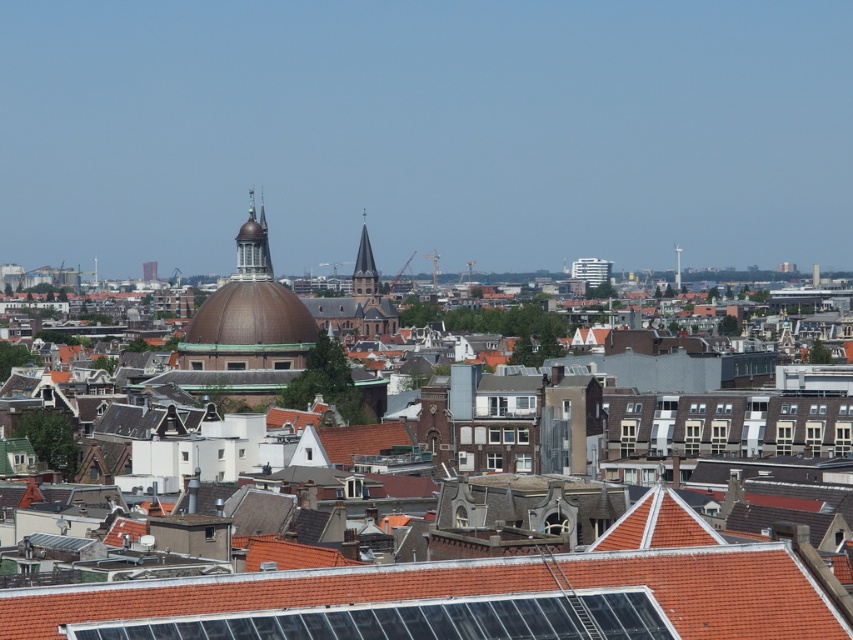
Question: Is red tile roof at center wider than brown copper dome at center?

Choices:
 (A) yes
 (B) no

Answer: (A)

Question: Does red tile roof at center have a larger size compared to brown copper dome at center?

Choices:
 (A) yes
 (B) no

Answer: (B)

Question: Is red tile roof at center behind brown copper dome at center?

Choices:
 (A) no
 (B) yes

Answer: (A)

Question: Which point is closer to the camera?

Choices:
 (A) red tile roof at center
 (B) brown copper dome at center

Answer: (A)

Question: Which object is closer to the camera taking this photo?

Choices:
 (A) brown copper dome at center
 (B) red tile roof at center

Answer: (B)